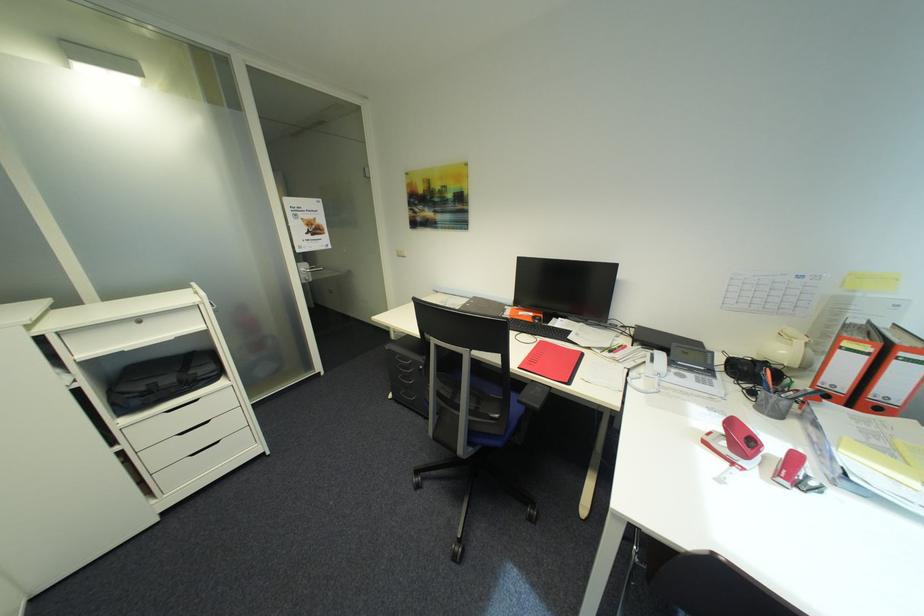
You are a GUI agent. You are given a task and a screenshot of the screen. Output one action in this format:
    pyautogui.click(x=<x>, y=<y>)
    Task: Click on the black laptop bag
    Image resolution: width=924 pixels, height=616 pixels.
    Given the screenshot: What is the action you would take?
    pyautogui.click(x=162, y=379)